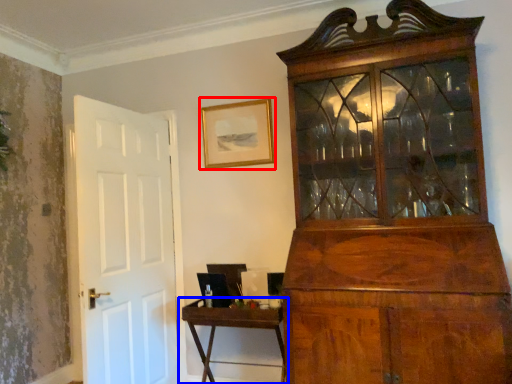
Question: Which of the following is the farthest to the observer, picture frame (highlighted by a red box) or table (highlighted by a blue box)?

Choices:
 (A) picture frame
 (B) table

Answer: (A)